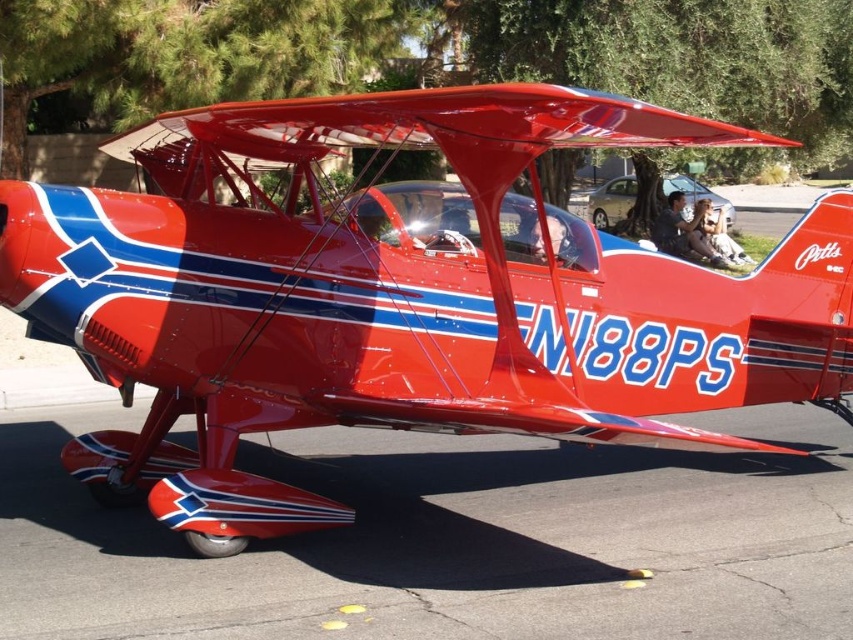
Who is positioned more to the left, glossy asphalt tarmac at lower center or transparent acrylic cockpit at center?

Positioned to the left is glossy asphalt tarmac at lower center.

Is point (585, 588) behind point (509, 250)?

No, (585, 588) is closer to viewer.

This screenshot has height=640, width=853. What are the coordinates of `glossy asphalt tarmac at lower center` in the screenshot? It's located at (450, 540).

Between glossy red airplane at center and matte black pilot at center, which one has less height?

Standing shorter between the two is matte black pilot at center.

Locate an element on the screen. glossy red airplane at center is located at coordinates (399, 296).

The height and width of the screenshot is (640, 853). Describe the element at coordinates (399, 296) in the screenshot. I see `glossy red airplane at center` at that location.

I want to click on glossy red airplane at center, so click(399, 296).

Can you confirm if glossy asphalt tarmac at lower center is positioned to the right of matte black pilot at center?

Incorrect, glossy asphalt tarmac at lower center is not on the right side of matte black pilot at center.

How much distance is there between glossy asphalt tarmac at lower center and matte black pilot at center?

glossy asphalt tarmac at lower center and matte black pilot at center are 14.86 meters apart.

I want to click on glossy asphalt tarmac at lower center, so click(x=450, y=540).

Find the location of a particular element. The height and width of the screenshot is (640, 853). glossy asphalt tarmac at lower center is located at coordinates (450, 540).